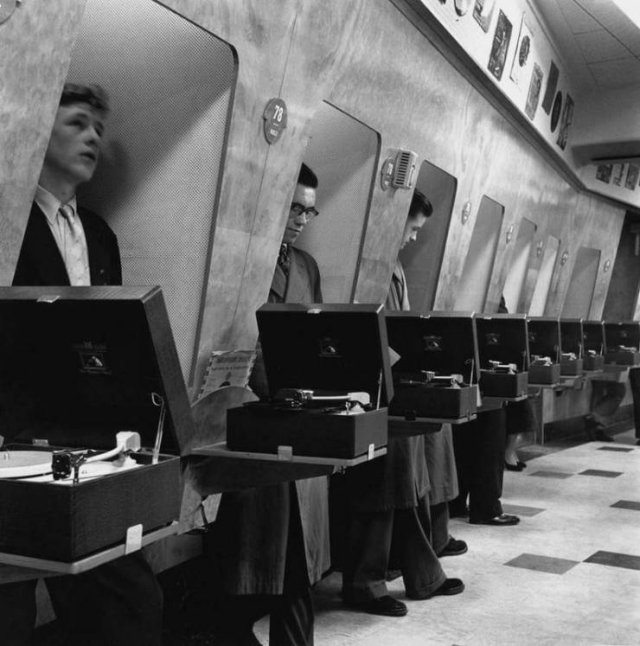
Identify the location of far booth. (586, 265).